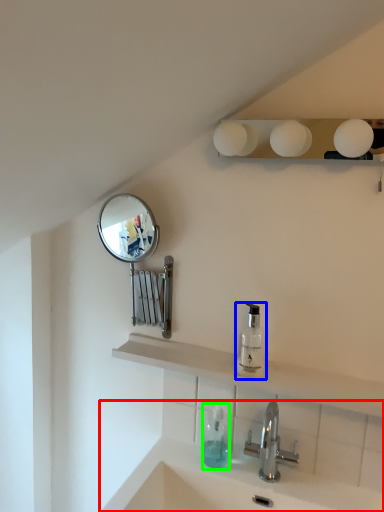
Question: Considering the real-world distances, which object is farthest from sink (highlighted by a red box)? soap dispenser (highlighted by a blue box) or soap dispenser (highlighted by a green box)?

Choices:
 (A) soap dispenser
 (B) soap dispenser

Answer: (A)